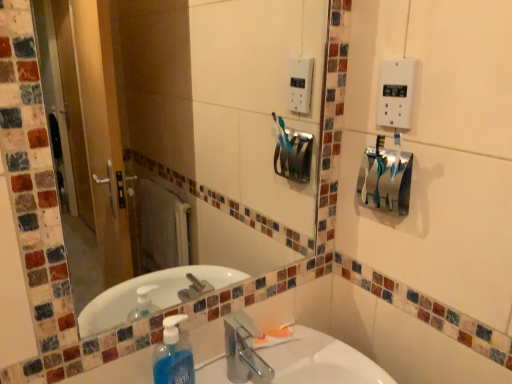
Find the location of `translucent orange tube at sink`. translucent orange tube at sink is located at coordinates (274, 337).

Identify the location of metallic silver hand dryer at upper right. (385, 179).

This screenshot has height=384, width=512. I want to click on translucent orange tube at sink, so click(274, 337).

Who is bigger, white plastic light switch at upper right or translucent orange tube at sink?

translucent orange tube at sink.

Is point (378, 112) positioned in front of point (274, 335)?

Yes, point (378, 112) is closer to viewer.

Does white plastic light switch at upper right have a lesser width compared to translucent orange tube at sink?

Correct, the width of white plastic light switch at upper right is less than that of translucent orange tube at sink.

Considering the positions of objects white plastic light switch at upper right and blue translucent liquid soap at lower left in the image provided, who is behind, white plastic light switch at upper right or blue translucent liquid soap at lower left?

white plastic light switch at upper right is behind.

Does point (388, 125) come behind point (178, 345)?

Yes.

From the picture: Considering the relative positions of white plastic light switch at upper right and blue translucent liquid soap at lower left in the image provided, is white plastic light switch at upper right to the right of blue translucent liquid soap at lower left from the viewer's perspective?

Indeed, white plastic light switch at upper right is positioned on the right side of blue translucent liquid soap at lower left.

Is white plastic light switch at upper right with blue translucent liquid soap at lower left?

No, white plastic light switch at upper right is not making contact with blue translucent liquid soap at lower left.

Would you say translucent orange tube at sink is to the left or to the right of metallic silver hand dryer at upper right in the picture?

Based on their positions, translucent orange tube at sink is located to the left of metallic silver hand dryer at upper right.

How far apart are translucent orange tube at sink and metallic silver hand dryer at upper right?

The distance of translucent orange tube at sink from metallic silver hand dryer at upper right is 17.62 inches.

Are translucent orange tube at sink and metallic silver hand dryer at upper right making contact?

No.

From a real-world perspective, between translucent orange tube at sink and metallic silver hand dryer at upper right, who is vertically lower?

translucent orange tube at sink.

Is metallic silver hand dryer at upper right turned away from white plastic light switch at upper right?

No, metallic silver hand dryer at upper right is not facing away from white plastic light switch at upper right.

Is metallic silver hand dryer at upper right in front of or behind white plastic light switch at upper right in the image?

metallic silver hand dryer at upper right is positioned farther from the viewer than white plastic light switch at upper right.

Where is `hand dryer to the right of white glossy sink at lower center`? hand dryer to the right of white glossy sink at lower center is located at coordinates tap(385, 179).

Is white glossy sink at lower center to the left of metallic silver hand dryer at upper right from the viewer's perspective?

Correct, you'll find white glossy sink at lower center to the left of metallic silver hand dryer at upper right.

Is white glossy sink at lower center wider than metallic silver hand dryer at upper right?

Indeed, white glossy sink at lower center has a greater width compared to metallic silver hand dryer at upper right.

Does point (298, 298) lie in front of point (388, 187)?

No, it is behind (388, 187).

Locate an element on the screen. The width and height of the screenshot is (512, 384). light switch above the translucent orange tube at sink (from a real-world perspective) is located at coordinates (396, 93).

Is point (272, 342) positioned after point (412, 96)?

Yes, it is behind point (412, 96).

Considering the relative positions of translucent orange tube at sink and white plastic light switch at upper right in the image provided, is translucent orange tube at sink to the left or to the right of white plastic light switch at upper right?

translucent orange tube at sink is positioned on white plastic light switch at upper right's left side.

From the image's perspective, is translucent orange tube at sink located beneath white plastic light switch at upper right?

Correct, translucent orange tube at sink appears lower than white plastic light switch at upper right in the image.

Considering the positions of point (191, 135) and point (162, 381), is point (191, 135) closer or farther from the camera than point (162, 381)?

Point (191, 135) is farther from the camera than point (162, 381).

In the scene shown: Is clear glass mirror at upper center at the left side of blue translucent liquid soap at lower left?

No.

How different are the orientations of clear glass mirror at upper center and blue translucent liquid soap at lower left in degrees?

4.8 degrees.

Consider the image. Is clear glass mirror at upper center not within blue translucent liquid soap at lower left?

Yes, clear glass mirror at upper center is not within blue translucent liquid soap at lower left.

This screenshot has height=384, width=512. In order to click on toothpaste that is under the white plastic light switch at upper right (from a real-world perspective) in this screenshot , I will do `click(274, 337)`.

You are a GUI agent. You are given a task and a screenshot of the screen. Output one action in this format:
    pyautogui.click(x=<x>, y=<y>)
    Task: Click on the light switch on the right of blue translucent liquid soap at lower left
    Image resolution: width=512 pixels, height=384 pixels.
    Given the screenshot: What is the action you would take?
    pyautogui.click(x=396, y=93)

When comparing their distances from clear glass mirror at upper center, does translucent orange tube at sink or metallic silver hand dryer at upper right seem closer?

The object closer to clear glass mirror at upper center is metallic silver hand dryer at upper right.

Which object lies further to the anchor point clear glass mirror at upper center, white glossy sink at lower center or white plastic light switch at upper right?

Among the two, white plastic light switch at upper right is located further to clear glass mirror at upper center.

Which object lies nearer to the anchor point white plastic light switch at upper right, translucent orange tube at sink or clear glass mirror at upper center?

Among the two, translucent orange tube at sink is located nearer to white plastic light switch at upper right.

When comparing their distances from translucent orange tube at sink, does white glossy sink at lower center or clear glass mirror at upper center seem closer?

The object closer to translucent orange tube at sink is white glossy sink at lower center.

Based on their spatial positions, is translucent orange tube at sink or white plastic light switch at upper right closer to white glossy sink at lower center?

The object closer to white glossy sink at lower center is translucent orange tube at sink.

Which object lies nearer to the anchor point translucent orange tube at sink, white plastic light switch at upper right or metallic silver hand dryer at upper right?

metallic silver hand dryer at upper right lies closer to translucent orange tube at sink than the other object.

Considering their positions, is clear glass mirror at upper center positioned further to white glossy sink at lower center than translucent orange tube at sink?

Among the two, clear glass mirror at upper center is located further to white glossy sink at lower center.

When comparing their distances from metallic silver hand dryer at upper right, does white plastic light switch at upper right or clear glass mirror at upper center seem closer?

white plastic light switch at upper right lies closer to metallic silver hand dryer at upper right than the other object.

You are a GUI agent. You are given a task and a screenshot of the screen. Output one action in this format:
    pyautogui.click(x=<x>, y=<y>)
    Task: Click on the mirror between white plastic light switch at upper right and white glossy sink at lower center in the vertical direction
    
    Given the screenshot: What is the action you would take?
    pyautogui.click(x=222, y=117)

The width and height of the screenshot is (512, 384). What are the coordinates of `mirror between white plastic light switch at upper right and translucent orange tube at sink from top to bottom` in the screenshot? It's located at (222, 117).

Locate an element on the screen. The height and width of the screenshot is (384, 512). cleaning product between metallic silver hand dryer at upper right and white glossy sink at lower center from top to bottom is located at coordinates pyautogui.click(x=173, y=354).

This screenshot has width=512, height=384. Find the location of `cleaning product that lies between white plastic light switch at upper right and translucent orange tube at sink from top to bottom`. cleaning product that lies between white plastic light switch at upper right and translucent orange tube at sink from top to bottom is located at coordinates (173, 354).